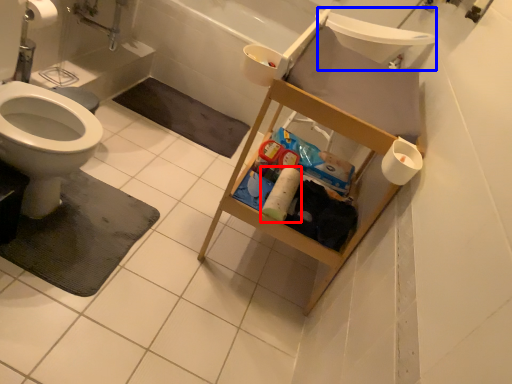
Question: Among these objects, which one is farthest to the camera, toilet paper (highlighted by a red box) or sink (highlighted by a blue box)?

Choices:
 (A) toilet paper
 (B) sink

Answer: (B)